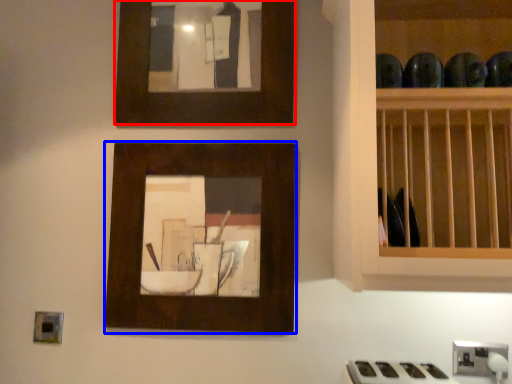
Question: Which object is closer to the camera taking this photo, picture frame (highlighted by a red box) or picture frame (highlighted by a blue box)?

Choices:
 (A) picture frame
 (B) picture frame

Answer: (B)